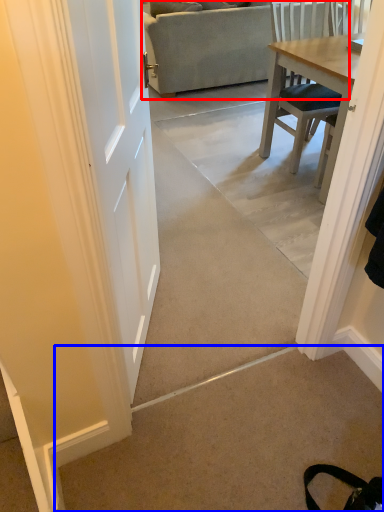
Question: Which point is further to the camera, studio couch (highlighted by a red box) or concrete (highlighted by a blue box)?

Choices:
 (A) studio couch
 (B) concrete

Answer: (A)